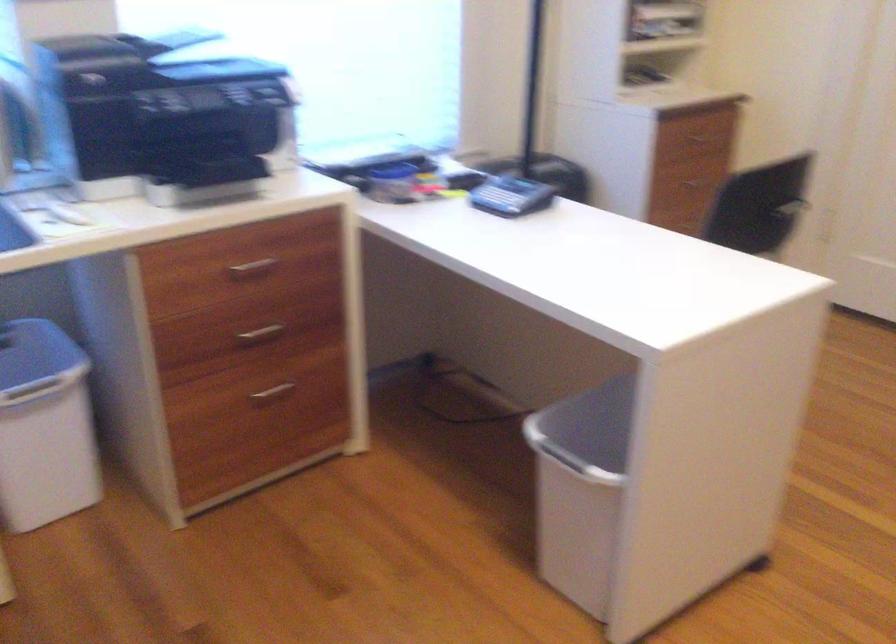
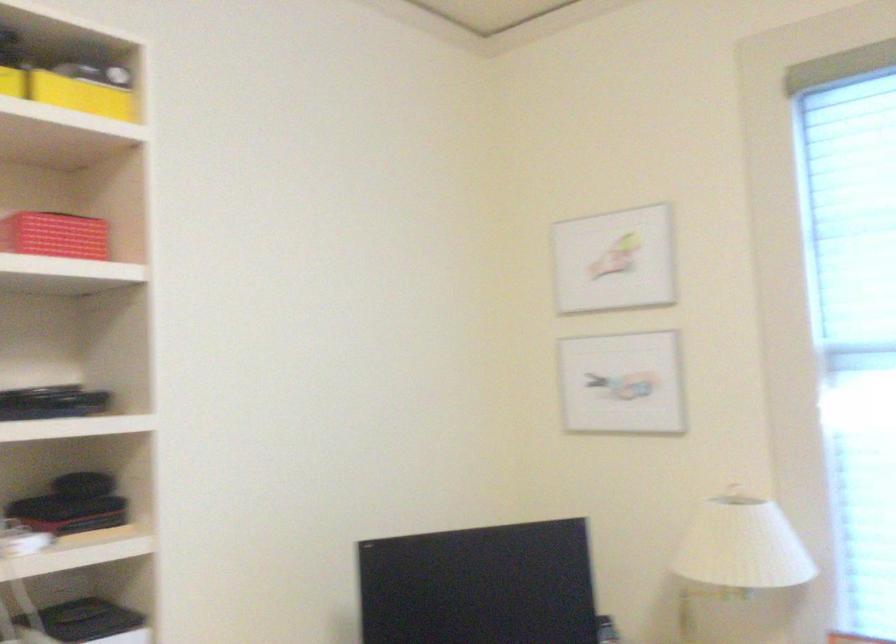
Question: The camera is either moving clockwise (left) or counter-clockwise (right) around the object. The first image is from the beginning of the video and the second image is from the end. Is the camera moving left or right when shooting the video?

Choices:
 (A) Left
 (B) Right

Answer: (B)